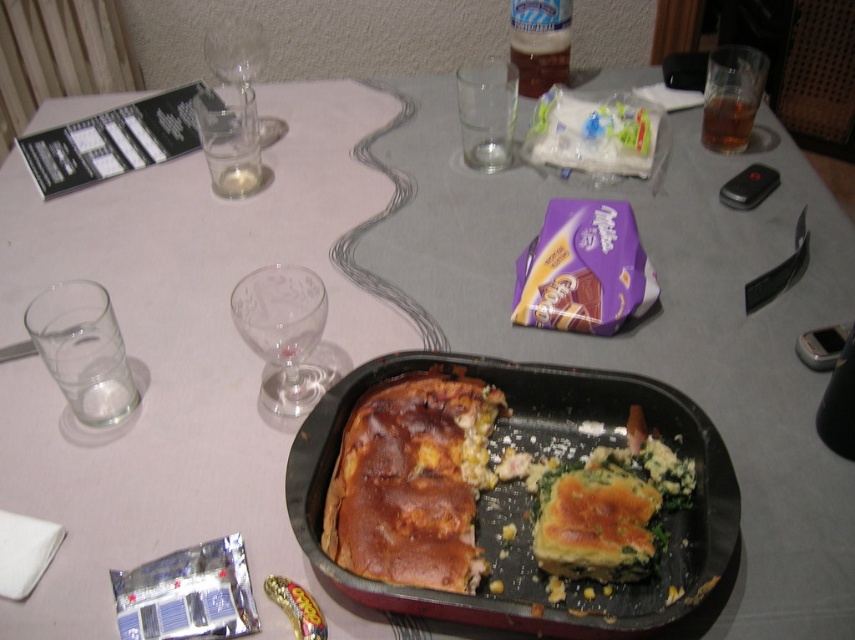
Question: Based on their relative distances, which object is nearer to the golden brown crusty bread at center?

Choices:
 (A) transparent glass wine glass at upper left
 (B) golden brown flaky pastry at center
 (C) clear glass wine glass at center
 (D) brown translucent glass at upper right

Answer: (B)

Question: Which point is closer to the camera taking this photo?

Choices:
 (A) (337, 580)
 (B) (293, 278)
 (C) (226, 45)

Answer: (A)

Question: Does black plastic tray at center appear over golden brown crusty bread at center?

Choices:
 (A) yes
 (B) no

Answer: (B)

Question: Does golden brown flaky pastry at center appear on the right side of brown translucent glass at upper right?

Choices:
 (A) no
 (B) yes

Answer: (A)

Question: Where is black plastic tray at center located in relation to golden brown crusty bread at center in the image?

Choices:
 (A) left
 (B) right

Answer: (B)

Question: Considering the real-world distances, which object is closest to the golden brown flaky pastry at center?

Choices:
 (A) transparent glass wine glass at upper left
 (B) black plastic tray at center
 (C) golden brown crusty bread at center
 (D) clear glass wine glass at center

Answer: (B)